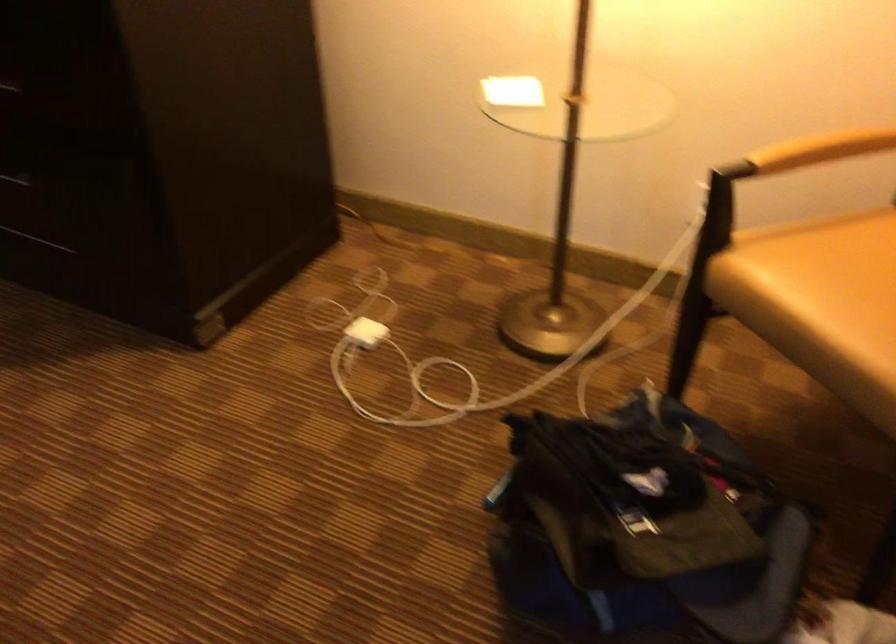
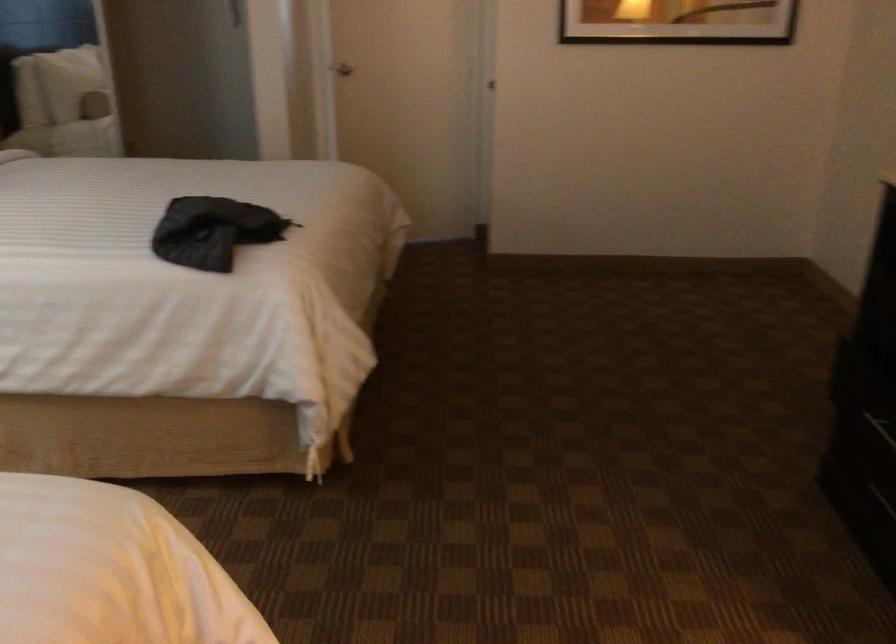
Question: How did the camera likely rotate?

Choices:
 (A) Left
 (B) Right
 (C) Up
 (D) Down

Answer: (A)